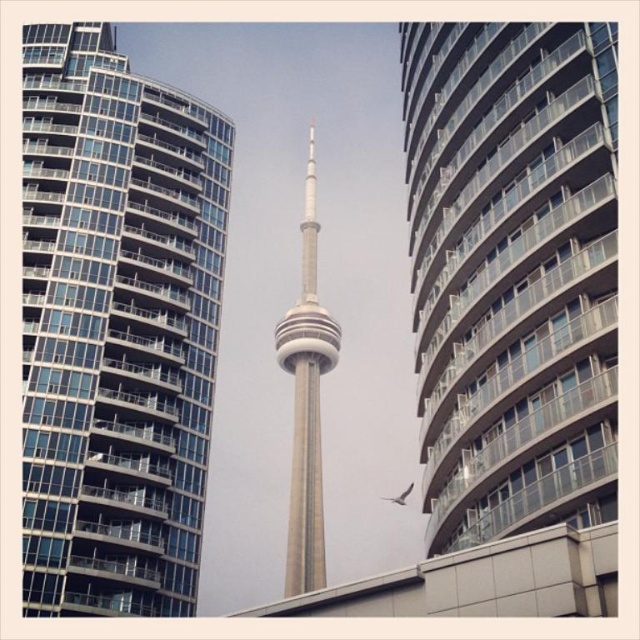
Find the location of a particular element. The image size is (640, 640). glassy steel building at left is located at coordinates (115, 326).

Which of these two, glassy steel building at left or smooth glass building at center, stands shorter?

smooth glass building at center is shorter.

Does point (198, 177) come closer to viewer compared to point (589, 378)?

No, (198, 177) is behind (589, 378).

Locate an element on the screen. The image size is (640, 640). glassy steel building at left is located at coordinates (115, 326).

Can you confirm if smooth glass building at center is positioned to the left of gray concrete tower at center?

In fact, smooth glass building at center is to the right of gray concrete tower at center.

The height and width of the screenshot is (640, 640). In order to click on smooth glass building at center in this screenshot , I will do `click(513, 273)`.

Locate an element on the screen. Image resolution: width=640 pixels, height=640 pixels. smooth glass building at center is located at coordinates (513, 273).

This screenshot has height=640, width=640. What do you see at coordinates (115, 326) in the screenshot?
I see `glassy steel building at left` at bounding box center [115, 326].

Can you confirm if glassy steel building at left is positioned below gray concrete tower at center?

Incorrect, glassy steel building at left is not positioned below gray concrete tower at center.

Is point (33, 340) farther from camera compared to point (316, 544)?

No, it is in front of (316, 544).

The width and height of the screenshot is (640, 640). Find the location of `glassy steel building at left`. glassy steel building at left is located at coordinates (115, 326).